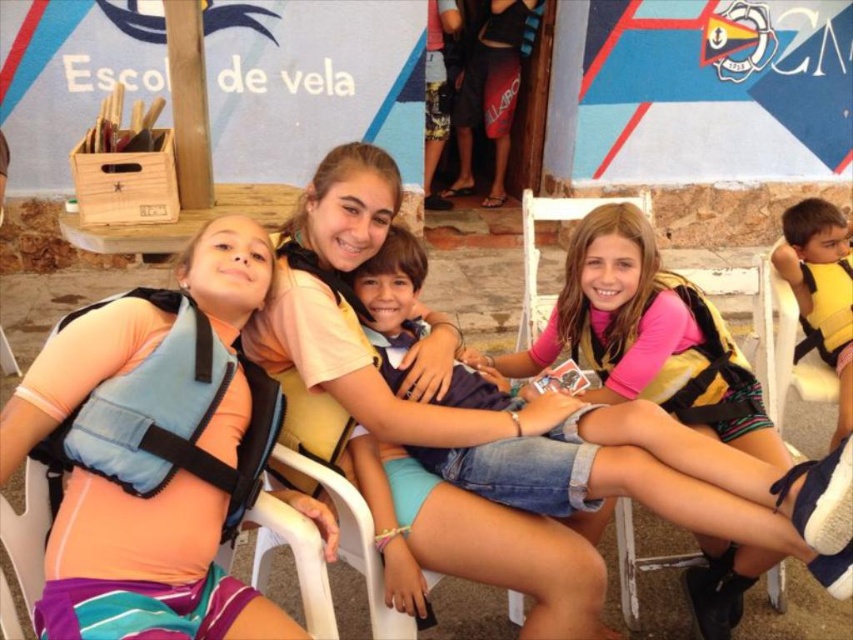
You are a photographer trying to capture a clear shot of both the yellow life vest at center and the yellow life vest at lower right. Which one will appear smaller in your photo?

The yellow life vest at center appears smaller in the photo because it has a lesser height compared to the yellow life vest at lower right.

You are standing at the origin point of the coordinate system in the image. You need to locate the yellow life vest at center. Which direction should you move to reach it?

The yellow life vest at center is located at coordinates point (631, 477), so you should move to the right and slightly upwards to reach it.